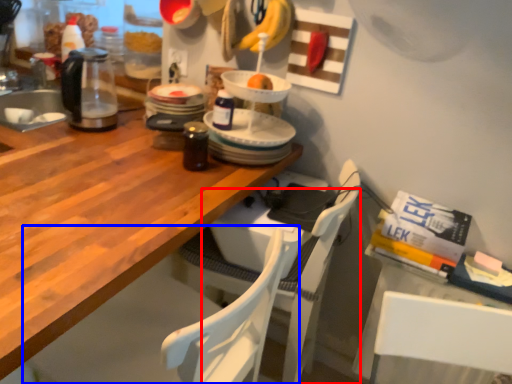
Question: Which point is further to the camera, chair (highlighted by a red box) or chair (highlighted by a blue box)?

Choices:
 (A) chair
 (B) chair

Answer: (A)